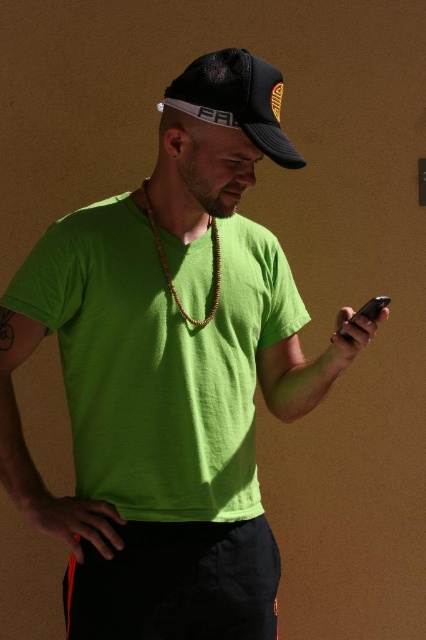
Who is more distant from viewer, [124,289] or [249,102]?

The point [124,289] is behind.

This screenshot has width=426, height=640. I want to click on lime green t-shirt at center, so click(x=158, y=360).

Between point (281, 282) and point (195, 97), which one is positioned in front?

Positioned in front is point (195, 97).

Where is `lime green t-shirt at center`? This screenshot has height=640, width=426. lime green t-shirt at center is located at coordinates (158, 360).

In the scene shown: Is black mesh baseball cap at upper center bigger than brown wooden necklace at center?

Correct, black mesh baseball cap at upper center is larger in size than brown wooden necklace at center.

Describe the element at coordinates (236, 99) in the screenshot. The width and height of the screenshot is (426, 640). I see `black mesh baseball cap at upper center` at that location.

The height and width of the screenshot is (640, 426). What are the coordinates of `black mesh baseball cap at upper center` in the screenshot? It's located at (236, 99).

Can you confirm if lime green t-shirt at center is positioned to the right of white fabric earphones at upper center?

No, lime green t-shirt at center is not to the right of white fabric earphones at upper center.

Is lime green t-shirt at center taller than white fabric earphones at upper center?

Yes, lime green t-shirt at center is taller than white fabric earphones at upper center.

Which is in front, point (25, 273) or point (196, 116)?

Point (196, 116) is in front.

Where is `lime green t-shirt at center`? This screenshot has width=426, height=640. lime green t-shirt at center is located at coordinates (158, 360).